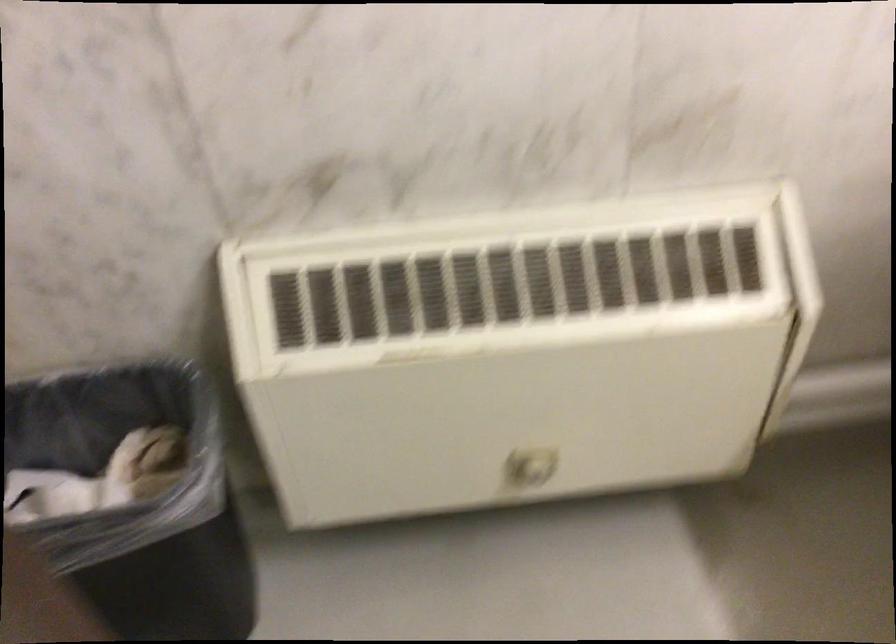
Find the location of a particular element. heater dial is located at coordinates (530, 466).